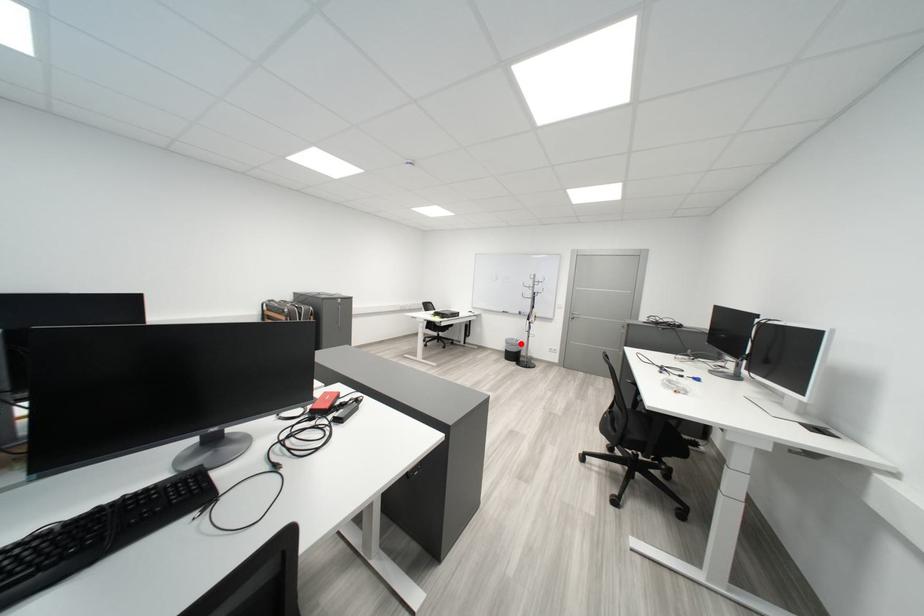
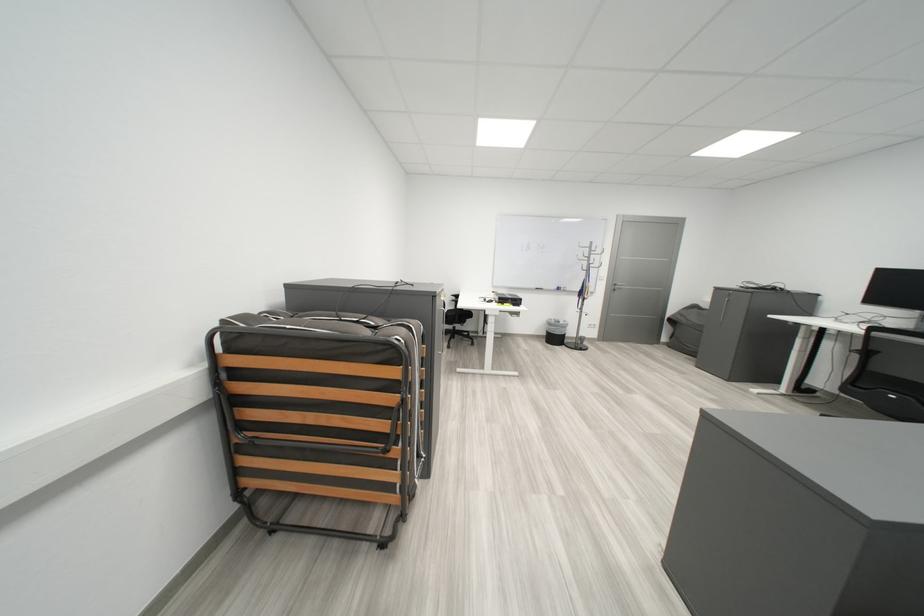
Question: I am providing you with two images of the same scene from different viewpoints. Given a red point in image1, look at the same physical point in image2. Is it:

Choices:
 (A) Closer to the viewpoint
 (B) Farther from the viewpoint

Answer: (B)